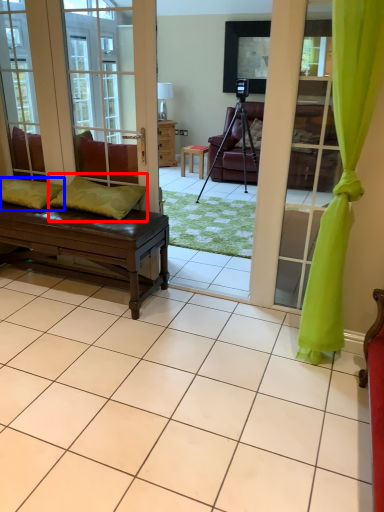
Question: Among these objects, which one is farthest to the camera, pillow (highlighted by a red box) or pillow (highlighted by a blue box)?

Choices:
 (A) pillow
 (B) pillow

Answer: (B)